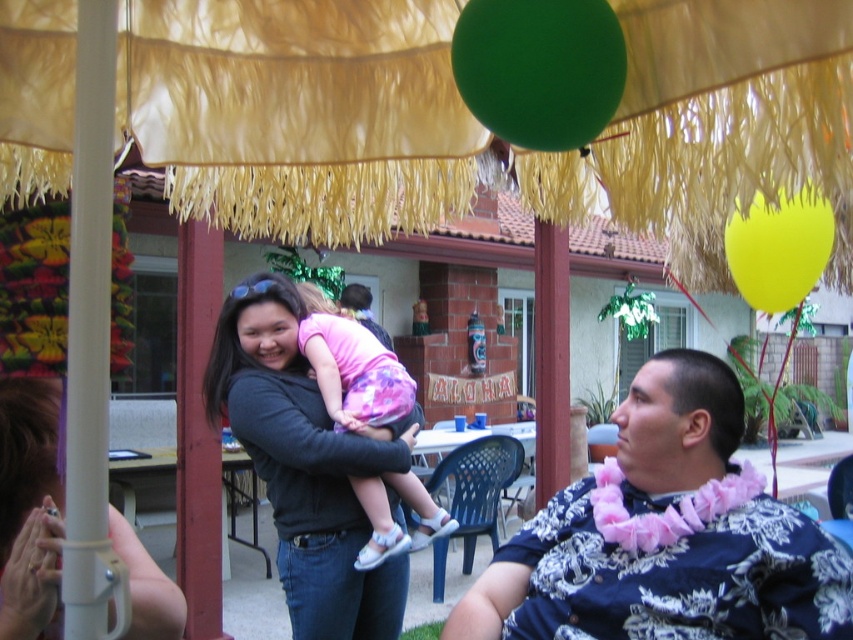
Does yellow textured fabric canopy at upper center lie in front of pink fabric dress at center?

Yes, it is in front of pink fabric dress at center.

Does point (546, 168) come farther from viewer compared to point (323, 358)?

That is False.

Locate an element on the screen. Image resolution: width=853 pixels, height=640 pixels. yellow textured fabric canopy at upper center is located at coordinates (300, 113).

Between yellow textured fabric canopy at upper center and green matte balloon at upper center, which one is positioned higher?

green matte balloon at upper center is above.

Is yellow textured fabric canopy at upper center in front of green matte balloon at upper center?

Yes, yellow textured fabric canopy at upper center is in front of green matte balloon at upper center.

Find the location of a particular element. yellow textured fabric canopy at upper center is located at coordinates pos(300,113).

The height and width of the screenshot is (640, 853). Identify the location of yellow textured fabric canopy at upper center. (300, 113).

Is green matte balloon at upper center taller than pink fabric dress at center?

Incorrect, green matte balloon at upper center's height is not larger of pink fabric dress at center's.

This screenshot has height=640, width=853. I want to click on green matte balloon at upper center, so click(x=538, y=68).

Who is more forward, (524, 42) or (326, 339)?

Point (524, 42)

This screenshot has height=640, width=853. I want to click on green matte balloon at upper center, so click(x=538, y=68).